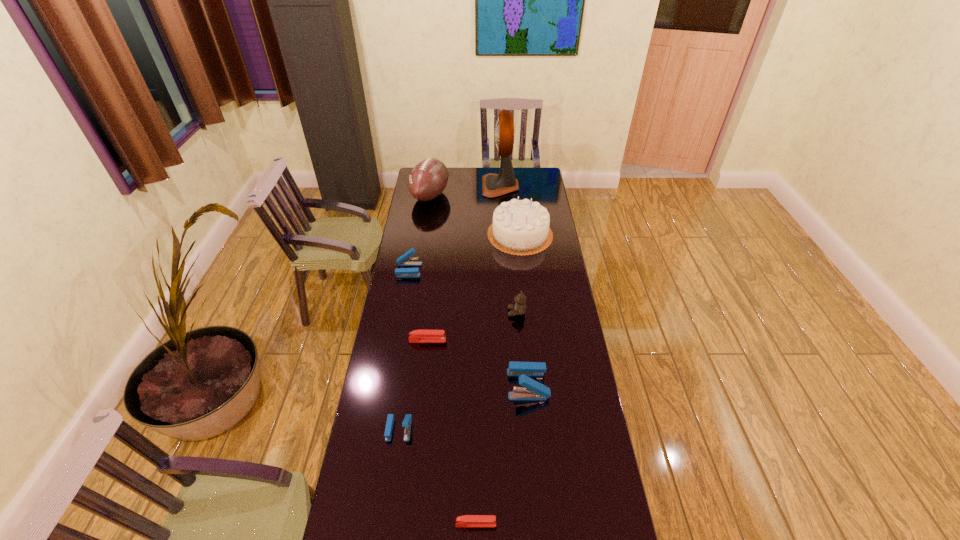
Where is `the seventh tallest object`? the seventh tallest object is located at coordinates (407, 421).

Identify the location of the fourth farthest stapler. The image size is (960, 540). (407, 421).

Locate an element on the screen. This screenshot has height=540, width=960. the bigger red stapler is located at coordinates (417, 336).

At what (x,y) coordinates should I click in order to perform the action: click on the left red stapler. Please return your answer as a coordinate pair (x, y). This screenshot has width=960, height=540. Looking at the image, I should click on (417, 336).

At what (x,y) coordinates should I click in order to perform the action: click on the shortest stapler. Please return your answer as a coordinate pair (x, y). Image resolution: width=960 pixels, height=540 pixels. Looking at the image, I should click on (x=465, y=520).

Find the location of a particular element. the shortest object is located at coordinates (465, 520).

The height and width of the screenshot is (540, 960). I want to click on vacant space situated 0.090m on the front-facing side of the brown fan, so click(x=468, y=186).

This screenshot has height=540, width=960. I want to click on free space located on the front-facing side of the brown fan, so click(434, 186).

Find the location of a particular element. The height and width of the screenshot is (540, 960). vacant region located on the front-facing side of the brown fan is located at coordinates (454, 186).

At what (x,y) coordinates should I click in order to perform the action: click on free spot located on the back of the football (American). Please return your answer as a coordinate pair (x, y). The image size is (960, 540). Looking at the image, I should click on (433, 174).